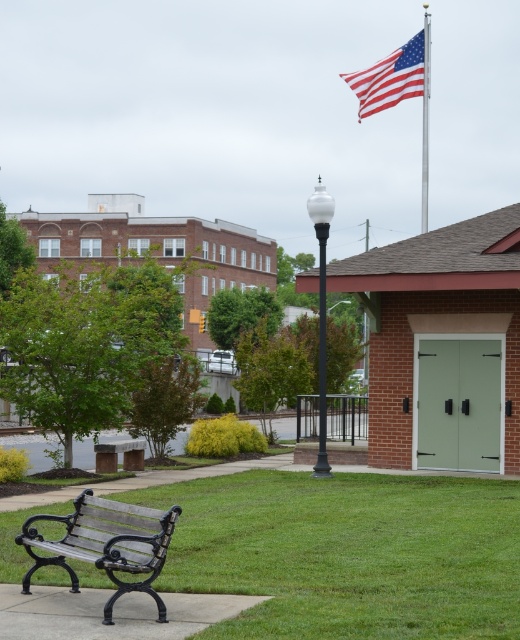
Question: Is red/white/blue fabric flag at upper right to the right of white glossy lamp post at center from the viewer's perspective?

Choices:
 (A) yes
 (B) no

Answer: (A)

Question: Is black wrought iron bench at lower left positioned behind red/white/blue fabric flag at upper right?

Choices:
 (A) no
 (B) yes

Answer: (A)

Question: Can you confirm if black wrought iron bench at lower left is thinner than white glossy lamp post at center?

Choices:
 (A) no
 (B) yes

Answer: (B)

Question: Which object is farther from the camera taking this photo?

Choices:
 (A) green grass at lower center
 (B) white glossy lamp post at center
 (C) black wrought iron bench at lower left

Answer: (B)

Question: Estimate the real-world distances between objects in this image. Which object is farther from the white glossy lamp post at center?

Choices:
 (A) red/white/blue fabric flag at upper right
 (B) green grass at lower center

Answer: (A)

Question: Among these points, which one is nearest to the camera?

Choices:
 (A) (79, 634)
 (B) (162, 554)
 (C) (422, 182)

Answer: (A)